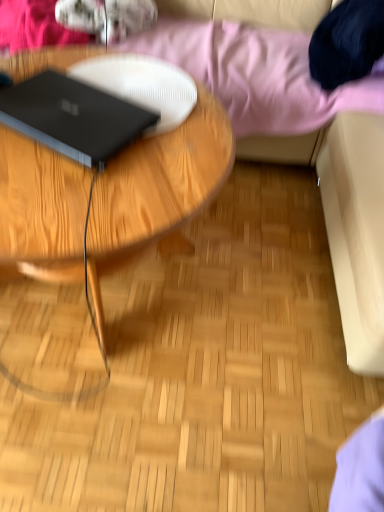
Question: Is wooden coffee table at center oriented away from pink fabric at upper center?

Choices:
 (A) yes
 (B) no

Answer: (A)

Question: Is wooden coffee table at center thinner than pink fabric at upper center?

Choices:
 (A) no
 (B) yes

Answer: (B)

Question: Considering the relative sizes of wooden coffee table at center and pink fabric at upper center in the image provided, is wooden coffee table at center bigger than pink fabric at upper center?

Choices:
 (A) yes
 (B) no

Answer: (B)

Question: From a real-world perspective, is wooden coffee table at center under pink fabric at upper center?

Choices:
 (A) no
 (B) yes

Answer: (B)

Question: Is wooden coffee table at center placed right next to pink fabric at upper center?

Choices:
 (A) no
 (B) yes

Answer: (A)

Question: Considering the relative positions of wooden coffee table at center and pink fabric at upper center in the image provided, is wooden coffee table at center to the left of pink fabric at upper center from the viewer's perspective?

Choices:
 (A) no
 (B) yes

Answer: (B)

Question: Is wooden coffee table at center looking in the opposite direction of black matte laptop at left?

Choices:
 (A) yes
 (B) no

Answer: (B)

Question: Could you tell me if wooden coffee table at center is facing black matte laptop at left?

Choices:
 (A) no
 (B) yes

Answer: (A)

Question: Considering the relative sizes of wooden coffee table at center and black matte laptop at left in the image provided, is wooden coffee table at center shorter than black matte laptop at left?

Choices:
 (A) no
 (B) yes

Answer: (A)

Question: Is wooden coffee table at center not inside black matte laptop at left?

Choices:
 (A) yes
 (B) no

Answer: (A)

Question: Is wooden coffee table at center taller than black matte laptop at left?

Choices:
 (A) yes
 (B) no

Answer: (A)

Question: Is wooden coffee table at center to the right of black matte laptop at left from the viewer's perspective?

Choices:
 (A) no
 (B) yes

Answer: (A)

Question: Can you confirm if pink fabric at upper center is taller than wooden coffee table at center?

Choices:
 (A) yes
 (B) no

Answer: (A)